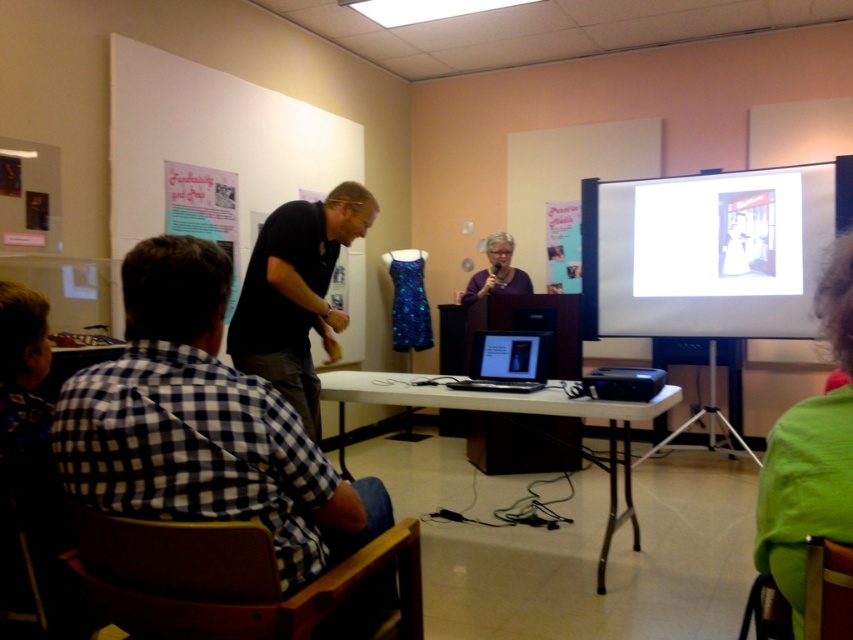
You are standing at the point labeled as point (254, 360) and want to move towards the speaker at the podium. Is the point labeled as point (849, 445) in your path?

Yes, the point labeled as point (849, 445) is in your path because it is in front of point (254, 360).

You are a technician who needs to connect the black glossy laptop at center to the black plastic projector at lower center using a 16 inch cable. Can you successfully connect them without needing a longer cable?

The black glossy laptop at center is 15.98 inches from the black plastic projector at lower center. Since the cable is 16 inches long, it is just barely long enough to connect them without needing a longer cable.

You are a speaker standing at the podium wearing a black matte shirt at center. You notice someone with green fuzzy hair at lower right in the audience. If you want to gesture towards them while speaking, can you reach them with your arm? Assume your arm length is 0.7 meters.

The distance between the black matte shirt at center and green fuzzy hair at lower right is 1.89 meters. Since your arm length is only 0.7 meters, you cannot physically reach them with your arm.